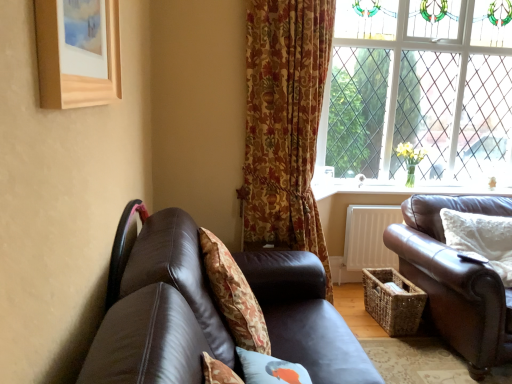
Question: Is white painted wood at lower right at the left side of wooden picture frame at upper left?

Choices:
 (A) yes
 (B) no

Answer: (B)

Question: Is white painted wood at lower right surrounding wooden picture frame at upper left?

Choices:
 (A) no
 (B) yes

Answer: (A)

Question: From a real-world perspective, is white painted wood at lower right located beneath wooden picture frame at upper left?

Choices:
 (A) no
 (B) yes

Answer: (B)

Question: Is white painted wood at lower right positioned before wooden picture frame at upper left?

Choices:
 (A) yes
 (B) no

Answer: (B)

Question: Is white painted wood at lower right shorter than wooden picture frame at upper left?

Choices:
 (A) yes
 (B) no

Answer: (A)

Question: Looking at the image, does brown leather couch at lower left, the first studio couch in the left-to-right sequence, seem bigger or smaller compared to white painted wood at lower right?

Choices:
 (A) big
 (B) small

Answer: (A)

Question: In terms of width, does brown leather couch at lower left, the first studio couch in the left-to-right sequence, look wider or thinner when compared to white painted wood at lower right?

Choices:
 (A) thin
 (B) wide

Answer: (B)

Question: Is brown leather couch at lower left, the second studio couch from the right, to the left or to the right of white painted wood at lower right in the image?

Choices:
 (A) left
 (B) right

Answer: (A)

Question: From their relative heights in the image, would you say brown leather couch at lower left, the first studio couch in the left-to-right sequence, is taller or shorter than white painted wood at lower right?

Choices:
 (A) tall
 (B) short

Answer: (A)

Question: Is point (450, 62) positioned closer to the camera than point (247, 288)?

Choices:
 (A) closer
 (B) farther

Answer: (B)

Question: In the image, is clear glass window at upper right positioned in front of or behind floral fabric cushion at center, which is the second pillow in back-to-front order?

Choices:
 (A) front
 (B) behind

Answer: (B)

Question: Considering the relative positions of clear glass window at upper right and floral fabric cushion at center, the third pillow positioned from the right, in the image provided, is clear glass window at upper right to the left or to the right of floral fabric cushion at center, the third pillow positioned from the right,?

Choices:
 (A) left
 (B) right

Answer: (B)

Question: Based on their sizes in the image, would you say clear glass window at upper right is bigger or smaller than floral fabric cushion at center, which is the second pillow in back-to-front order?

Choices:
 (A) big
 (B) small

Answer: (A)

Question: Is point (244, 276) positioned closer to the camera than point (361, 193)?

Choices:
 (A) closer
 (B) farther

Answer: (A)

Question: Would you say floral fabric cushion at center, which is counted as the 2th pillow, starting from the front, is to the left or to the right of white painted wood at lower right in the picture?

Choices:
 (A) right
 (B) left

Answer: (B)